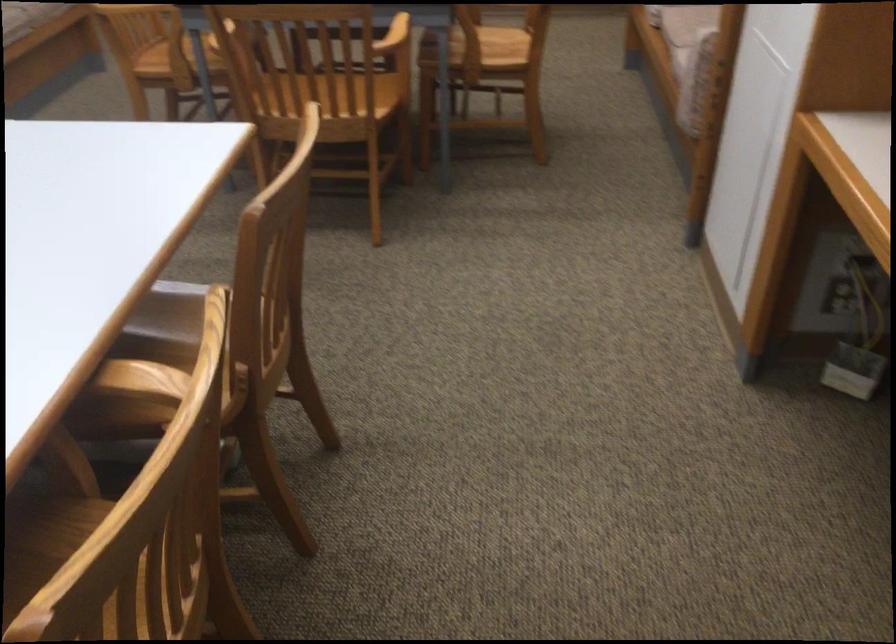
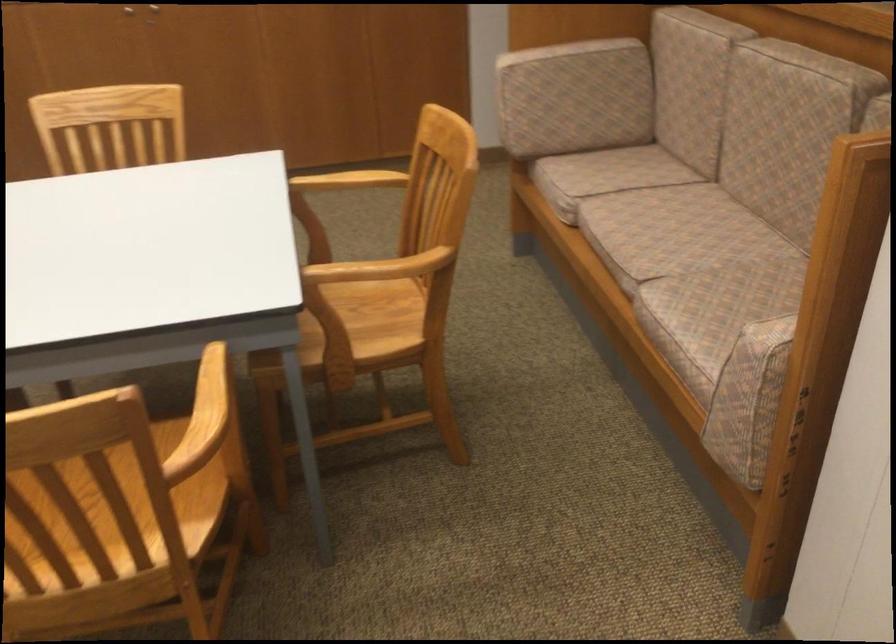
Question: In a continuous first-person perspective shot, in which direction is the camera moving?

Choices:
 (A) Left
 (B) Right
 (C) Forward
 (D) Backward

Answer: (C)